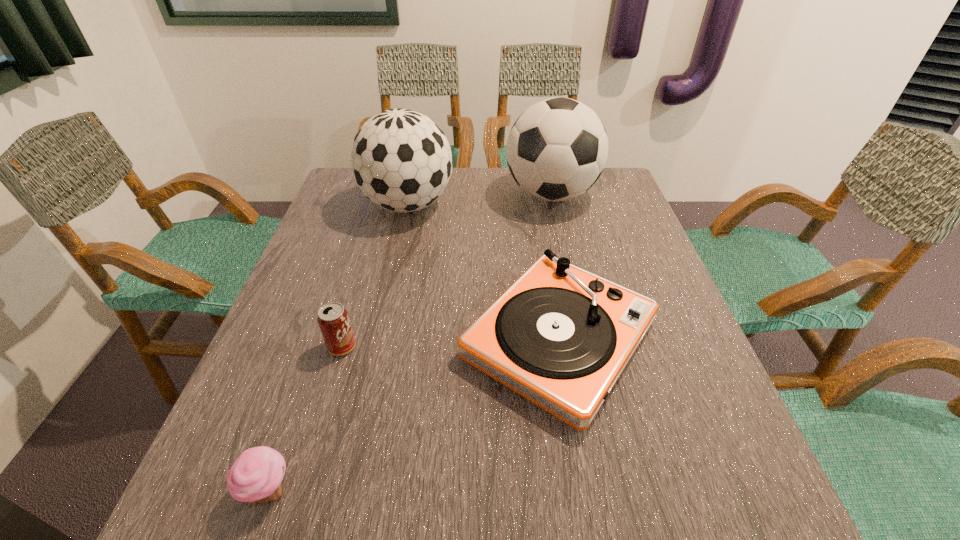
Locate an element on the screen. the right soccer ball is located at coordinates (557, 149).

Where is `the left soccer ball`? The height and width of the screenshot is (540, 960). the left soccer ball is located at coordinates (401, 160).

You are a GUI agent. You are given a task and a screenshot of the screen. Output one action in this format:
    pyautogui.click(x=<x>, y=<y>)
    Task: Click on the soda can
    This screenshot has width=960, height=540.
    Given the screenshot: What is the action you would take?
    pyautogui.click(x=333, y=319)

Find the location of `record player`. record player is located at coordinates (560, 336).

This screenshot has width=960, height=540. I want to click on cupcake, so click(x=255, y=477).

Locate an element on the screen. vacant space located on the front of the right soccer ball is located at coordinates (564, 250).

This screenshot has height=540, width=960. In order to click on free space located 0.400m on the right of the left soccer ball in this screenshot , I will do `click(590, 205)`.

You are a GUI agent. You are given a task and a screenshot of the screen. Output one action in this format:
    pyautogui.click(x=<x>, y=<y>)
    Task: Click on the vacant space located on the front of the soda can
    This screenshot has height=540, width=960.
    Given the screenshot: What is the action you would take?
    pyautogui.click(x=319, y=427)

The width and height of the screenshot is (960, 540). Identify the location of free region located on the back of the record player. (540, 232).

Locate an element on the screen. The height and width of the screenshot is (540, 960). blank space located on the right of the nearest object is located at coordinates (461, 490).